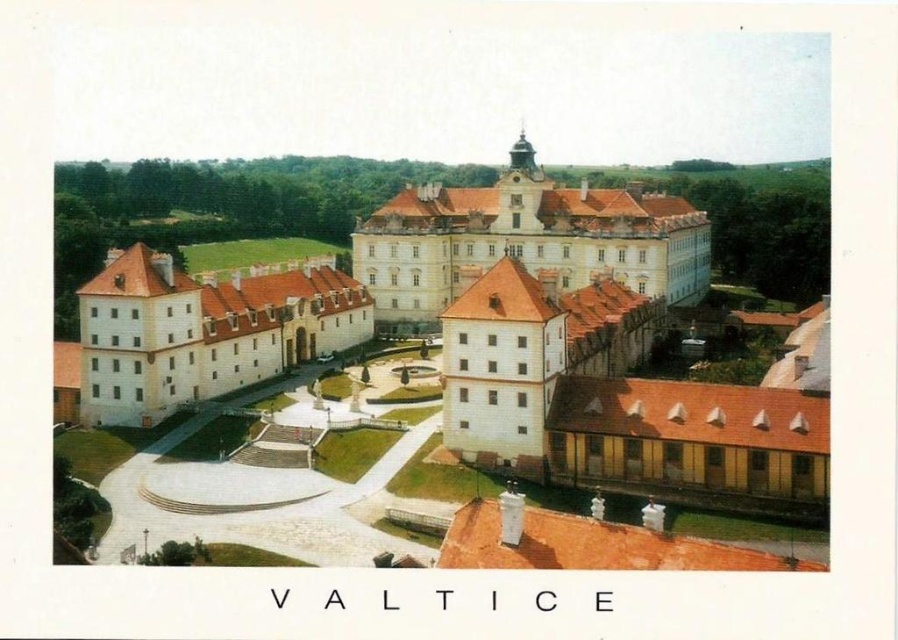
Question: Is white stone castle at center below white matte building at left?

Choices:
 (A) no
 (B) yes

Answer: (A)

Question: Which of the following is the farthest from the observer?

Choices:
 (A) (156, 339)
 (B) (654, 241)

Answer: (B)

Question: From the image, what is the correct spatial relationship of white stone castle at center in relation to white matte building at left?

Choices:
 (A) below
 (B) above

Answer: (B)

Question: Which point appears farthest from the camera in this image?

Choices:
 (A) (292, 292)
 (B) (389, 234)

Answer: (B)

Question: Can you confirm if white stone castle at center is positioned below white matte building at left?

Choices:
 (A) no
 (B) yes

Answer: (A)